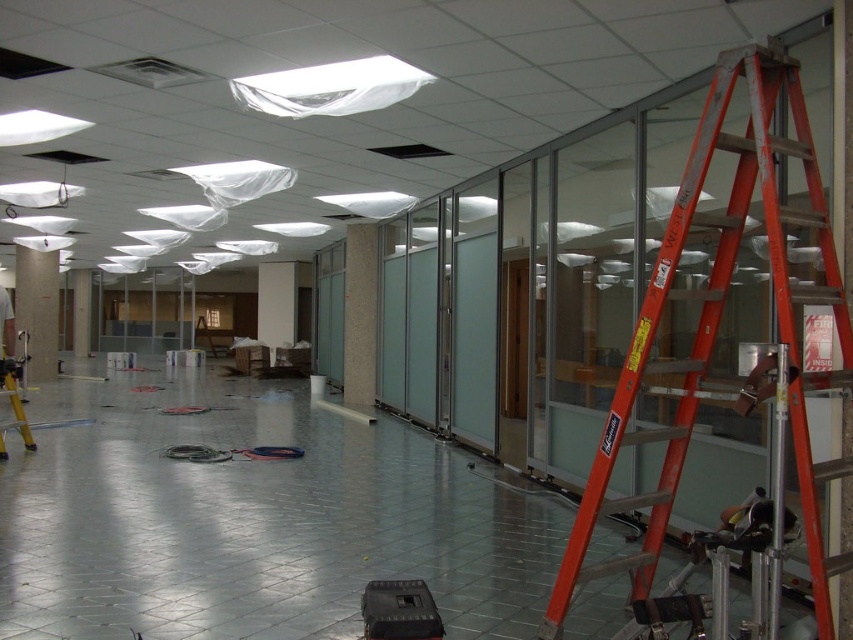
Does point (838, 282) come behind point (375, 266)?

No, (838, 282) is in front of (375, 266).

What do you see at coordinates (718, 324) in the screenshot?
I see `orange metallic ladder at right` at bounding box center [718, 324].

Where is `orange metallic ladder at right`? This screenshot has width=853, height=640. orange metallic ladder at right is located at coordinates (718, 324).

Consider the image. Does clear glass partition at center appear under matte gray pillar at left?

Correct, clear glass partition at center is located below matte gray pillar at left.

Is clear glass partition at center behind matte gray pillar at left?

No, it is in front of matte gray pillar at left.

This screenshot has height=640, width=853. Describe the element at coordinates (360, 314) in the screenshot. I see `clear glass partition at center` at that location.

Identify the location of clear glass partition at center. The width and height of the screenshot is (853, 640). (360, 314).

Does point (358, 372) come closer to viewer compared to point (410, 620)?

No, (358, 372) is behind (410, 620).

Is point (352, 298) farther from viewer compared to point (418, 608)?

Yes, it is.

Identify the location of clear glass partition at center. (360, 314).